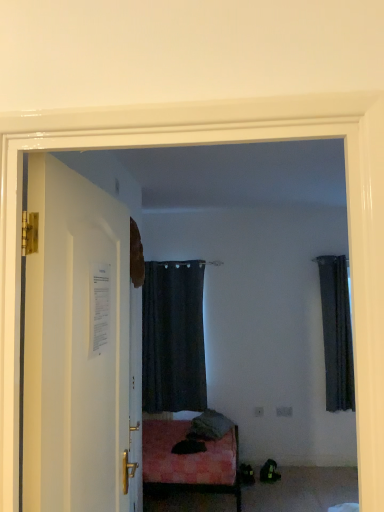
Measure the distance between point (328, 277) and camera.

A distance of 4.01 meters exists between point (328, 277) and camera.

Where is `black fabric curtain at center, acting as the first curtain starting from the left`? black fabric curtain at center, acting as the first curtain starting from the left is located at coordinates (173, 337).

From the picture: Measure the distance between black fabric curtain at center, acting as the first curtain starting from the left, and camera.

A distance of 12.61 feet exists between black fabric curtain at center, acting as the first curtain starting from the left, and camera.

At what (x,y) coordinates should I click in order to perform the action: click on white glossy door at left. Please return your answer as a coordinate pair (x, y). This screenshot has height=512, width=384. Looking at the image, I should click on (80, 340).

Is there a large distance between dark fabric curtain at right, marked as the first curtain in a right-to-left arrangement, and white glossy door at left?

Absolutely, dark fabric curtain at right, marked as the first curtain in a right-to-left arrangement, is distant from white glossy door at left.

Considering the sizes of objects dark fabric curtain at right, marked as the first curtain in a right-to-left arrangement, and white glossy door at left in the image provided, who is wider, dark fabric curtain at right, marked as the first curtain in a right-to-left arrangement, or white glossy door at left?

dark fabric curtain at right, marked as the first curtain in a right-to-left arrangement.

Can you tell me how much dark fabric curtain at right, the 2th curtain in the left-to-right sequence, and white glossy door at left differ in facing direction?

The angular difference between dark fabric curtain at right, the 2th curtain in the left-to-right sequence, and white glossy door at left is 87.8 degrees.

Considering the relative sizes of dark fabric curtain at right, the 2th curtain in the left-to-right sequence, and white glossy door at left in the image provided, is dark fabric curtain at right, the 2th curtain in the left-to-right sequence, taller than white glossy door at left?

Yes, dark fabric curtain at right, the 2th curtain in the left-to-right sequence, is taller than white glossy door at left.

From the image's perspective, which one is positioned lower, white glossy door at left or dark fabric curtain at right, marked as the first curtain in a right-to-left arrangement?

dark fabric curtain at right, marked as the first curtain in a right-to-left arrangement, appears lower in the image.

Can you tell me how much white glossy door at left and dark fabric curtain at right, marked as the first curtain in a right-to-left arrangement, differ in facing direction?

The angular difference between white glossy door at left and dark fabric curtain at right, marked as the first curtain in a right-to-left arrangement, is 87.8 degrees.

Do you think white glossy door at left is within dark fabric curtain at right, the 2th curtain in the left-to-right sequence, or outside of it?

white glossy door at left is spatially situated outside dark fabric curtain at right, the 2th curtain in the left-to-right sequence.

Between dark fabric curtain at right, the 2th curtain in the left-to-right sequence, and black fabric curtain at center, which is the 2th curtain in right-to-left order, which one appears on the left side from the viewer's perspective?

black fabric curtain at center, which is the 2th curtain in right-to-left order, is more to the left.

How many degrees apart are the facing directions of dark fabric curtain at right, marked as the first curtain in a right-to-left arrangement, and black fabric curtain at center, which is the 2th curtain in right-to-left order?

0.025 degrees.

The height and width of the screenshot is (512, 384). Identify the location of curtain below the dark fabric curtain at right, the 2th curtain in the left-to-right sequence (from a real-world perspective). (173, 337).

From the image's perspective, would you say dark fabric curtain at right, the 2th curtain in the left-to-right sequence, is shown under black fabric curtain at center, which is the 2th curtain in right-to-left order?

No, from the image's perspective, dark fabric curtain at right, the 2th curtain in the left-to-right sequence, is not below black fabric curtain at center, which is the 2th curtain in right-to-left order.

Considering the positions of point (188, 388) and point (333, 266), is point (188, 388) closer or farther from the camera than point (333, 266)?

Clearly, point (188, 388) is closer to the camera than point (333, 266).

Between black fabric curtain at center, which is the 2th curtain in right-to-left order, and dark fabric curtain at right, the 2th curtain in the left-to-right sequence, which one has less height?

dark fabric curtain at right, the 2th curtain in the left-to-right sequence, is shorter.

Considering the sizes of black fabric curtain at center, which is the 2th curtain in right-to-left order, and dark fabric curtain at right, marked as the first curtain in a right-to-left arrangement, in the image, is black fabric curtain at center, which is the 2th curtain in right-to-left order, bigger or smaller than dark fabric curtain at right, marked as the first curtain in a right-to-left arrangement,?

In the image, black fabric curtain at center, which is the 2th curtain in right-to-left order, appears to be larger than dark fabric curtain at right, marked as the first curtain in a right-to-left arrangement.

Find the location of a particular element. The height and width of the screenshot is (512, 384). curtain that is the 2nd object directly below the white glossy door at left (from a real-world perspective) is located at coordinates (173, 337).

Considering the positions of objects white glossy door at left and black fabric curtain at center, acting as the first curtain starting from the left, in the image provided, who is more to the right, white glossy door at left or black fabric curtain at center, acting as the first curtain starting from the left,?

black fabric curtain at center, acting as the first curtain starting from the left, is more to the right.

Who is bigger, white glossy door at left or black fabric curtain at center, which is the 2th curtain in right-to-left order?

black fabric curtain at center, which is the 2th curtain in right-to-left order.

Which point is more forward, (170, 349) or (90, 208)?

The point (90, 208) is closer to the camera.

Is black fabric curtain at center, acting as the first curtain starting from the left, turned away from white glossy door at left?

No, white glossy door at left is not at the back of black fabric curtain at center, acting as the first curtain starting from the left.

Could white glossy door at left be considered to be inside black fabric curtain at center, which is the 2th curtain in right-to-left order?

Actually, white glossy door at left is outside black fabric curtain at center, which is the 2th curtain in right-to-left order.

At what (x,y) coordinates should I click in order to perform the action: click on the 1st curtain behind the white glossy door at left. Please return your answer as a coordinate pair (x, y). This screenshot has height=512, width=384. Looking at the image, I should click on (336, 333).

The height and width of the screenshot is (512, 384). I want to click on the 2nd curtain counting from the right side of the white glossy door at left, so click(x=336, y=333).

Based on their spatial positions, is white glossy door at left or black fabric curtain at center, acting as the first curtain starting from the left, further from dark fabric curtain at right, the 2th curtain in the left-to-right sequence?

Among the two, white glossy door at left is located further to dark fabric curtain at right, the 2th curtain in the left-to-right sequence.

When comparing their distances from black fabric curtain at center, acting as the first curtain starting from the left, does dark fabric curtain at right, marked as the first curtain in a right-to-left arrangement, or white glossy door at left seem closer?

dark fabric curtain at right, marked as the first curtain in a right-to-left arrangement.

Estimate the real-world distances between objects in this image. Which object is further from white glossy door at left, dark fabric curtain at right, the 2th curtain in the left-to-right sequence, or black fabric curtain at center, which is the 2th curtain in right-to-left order?

dark fabric curtain at right, the 2th curtain in the left-to-right sequence, is positioned further to the anchor white glossy door at left.

Based on their spatial positions, is black fabric curtain at center, which is the 2th curtain in right-to-left order, or white glossy door at left closer to dark fabric curtain at right, marked as the first curtain in a right-to-left arrangement?

black fabric curtain at center, which is the 2th curtain in right-to-left order, is positioned closer to the anchor dark fabric curtain at right, marked as the first curtain in a right-to-left arrangement.

Considering their positions, is white glossy door at left positioned closer to black fabric curtain at center, which is the 2th curtain in right-to-left order, than dark fabric curtain at right, marked as the first curtain in a right-to-left arrangement?

Among the two, dark fabric curtain at right, marked as the first curtain in a right-to-left arrangement, is located nearer to black fabric curtain at center, which is the 2th curtain in right-to-left order.

Based on their spatial positions, is black fabric curtain at center, which is the 2th curtain in right-to-left order, or dark fabric curtain at right, the 2th curtain in the left-to-right sequence, further from white glossy door at left?

dark fabric curtain at right, the 2th curtain in the left-to-right sequence.

I want to click on curtain between white glossy door at left and black fabric curtain at center, acting as the first curtain starting from the left, in the front-back direction, so click(x=336, y=333).